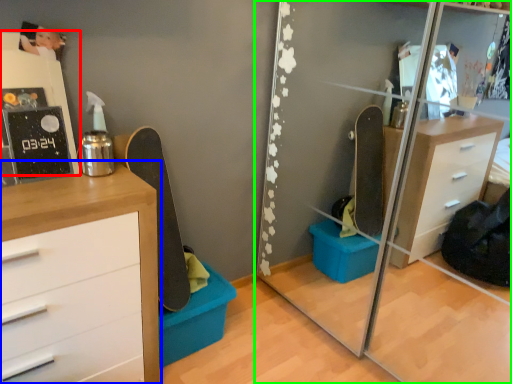
Question: Considering the real-world distances, which object is farthest from shelf (highlighted by a red box)? chest of drawers (highlighted by a blue box) or mirror (highlighted by a green box)?

Choices:
 (A) chest of drawers
 (B) mirror

Answer: (B)